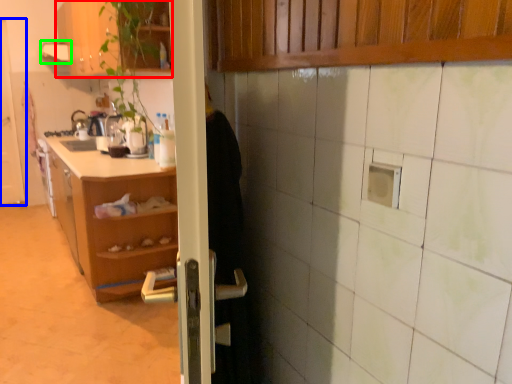
Question: Which is nearer to the cabinetry (highlighted by a red box)? door (highlighted by a blue box) or exhaust hood (highlighted by a green box).

Choices:
 (A) door
 (B) exhaust hood

Answer: (B)